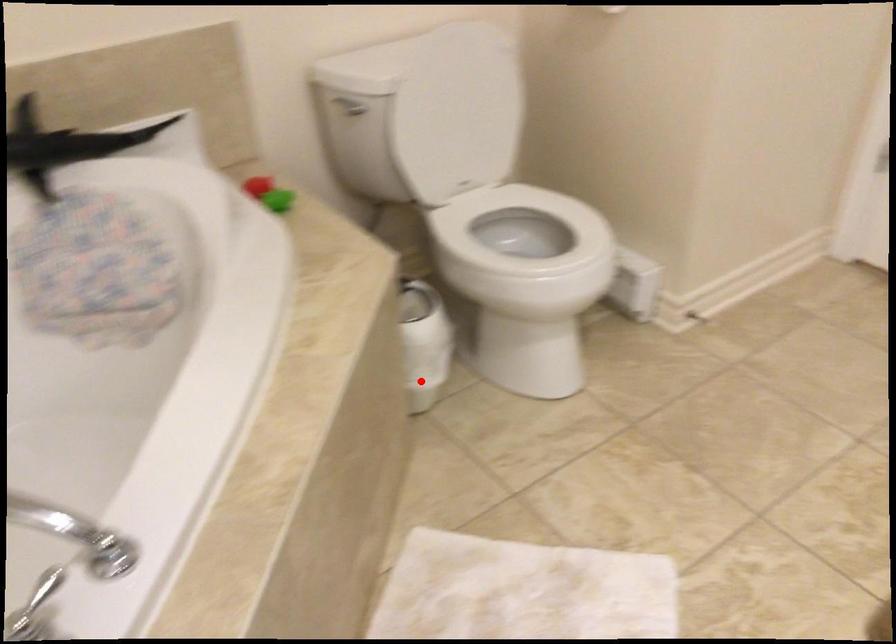
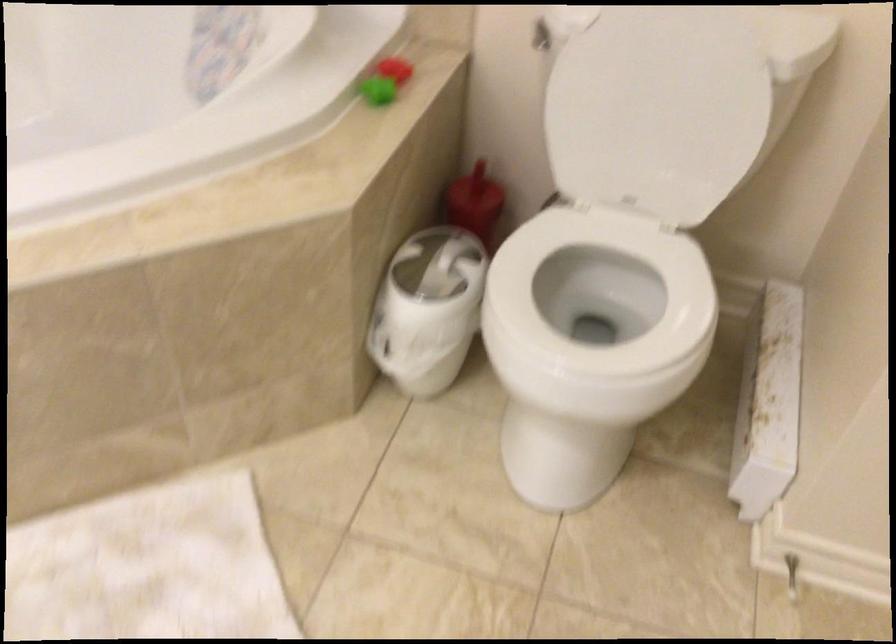
Find the pixel in the second image that matches the highlighted location in the first image.

(392, 357)